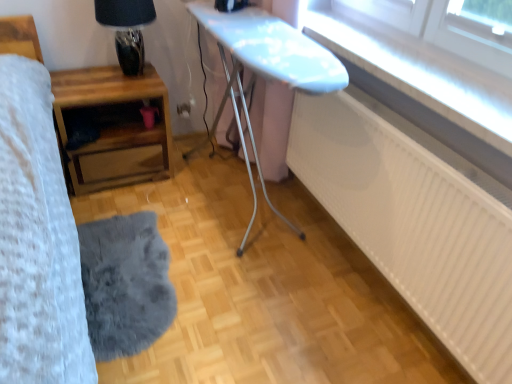
Where is `vacant area that lies to the right of wooden nightstand at left, which appears as the first table when viewed from the left`? The height and width of the screenshot is (384, 512). vacant area that lies to the right of wooden nightstand at left, which appears as the first table when viewed from the left is located at coordinates (190, 181).